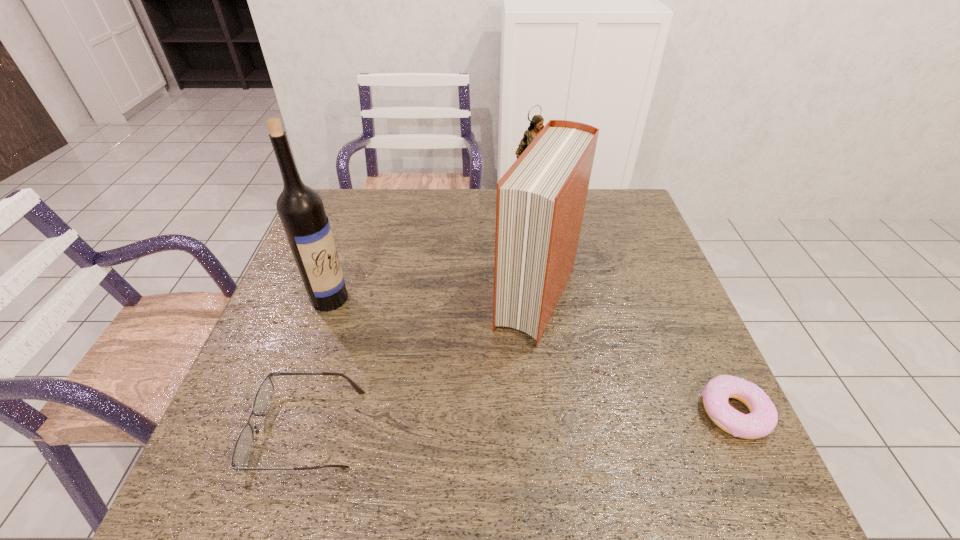
At what (x,y) coordinates should I click in order to perform the action: click on vacant space on the desktop that is between the spectacles and the rightmost object and is positioned on the label of the wine bottle. Please return your answer as a coordinate pair (x, y). This screenshot has width=960, height=540. Looking at the image, I should click on (519, 421).

Locate an element on the screen. The image size is (960, 540). vacant spot on the desktop that is between the spectacles and the doughnut and is positioned on the open cover of the hardback book is located at coordinates coord(470,422).

The image size is (960, 540). In order to click on free space on the desktop that is between the spectacles and the doughnut and is positioned on the front-facing side of the figurine in this screenshot , I will do `click(522, 420)`.